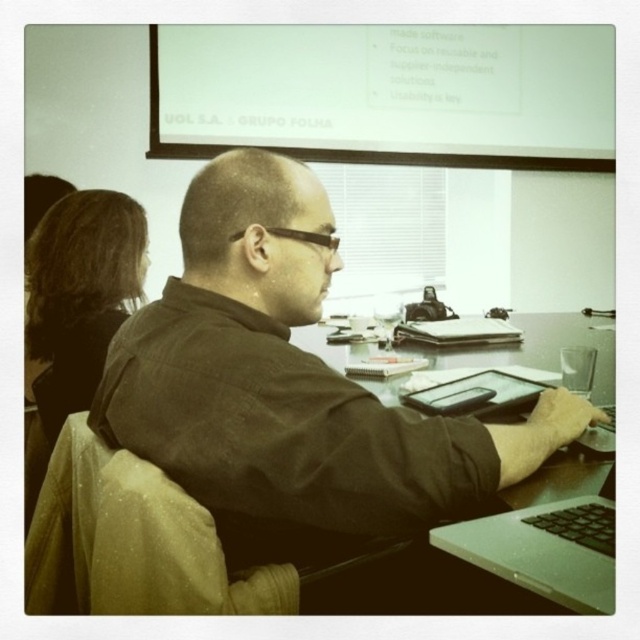
The height and width of the screenshot is (640, 640). I want to click on silver metallic computer desk at center, so click(536, 540).

Between silver metallic computer desk at center and brown hair at upper left, which one appears on the right side from the viewer's perspective?

From the viewer's perspective, silver metallic computer desk at center appears more on the right side.

Locate an element on the screen. The height and width of the screenshot is (640, 640). silver metallic computer desk at center is located at coordinates (536, 540).

Is black matte shirt at center smaller than brown hair at upper left?

Actually, black matte shirt at center might be larger than brown hair at upper left.

Can you confirm if black matte shirt at center is positioned to the right of brown hair at upper left?

Correct, you'll find black matte shirt at center to the right of brown hair at upper left.

Between point (307, 420) and point (116, 209), which one is positioned behind?

Positioned behind is point (116, 209).

Where is `black matte shirt at center`? black matte shirt at center is located at coordinates (291, 385).

Is black matte shirt at center wider than silver metallic computer desk at center?

No.

Between black matte shirt at center and silver metallic computer desk at center, which one is positioned higher?

black matte shirt at center is higher up.

Is point (416, 532) farther from viewer compared to point (524, 593)?

Yes.

Image resolution: width=640 pixels, height=640 pixels. I want to click on black matte shirt at center, so click(291, 385).